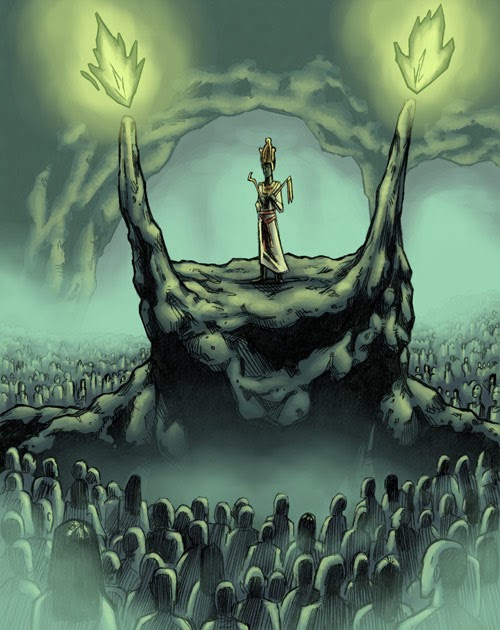
I want to click on white robe, so click(267, 237).